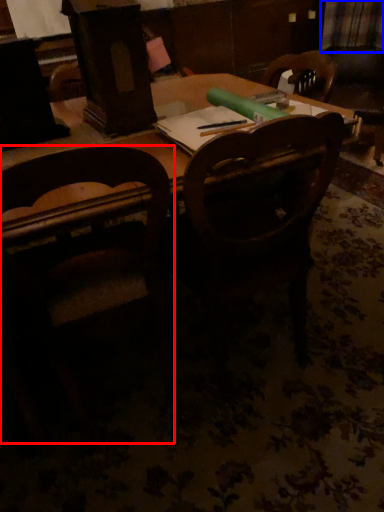
Question: Which object appears farthest to the camera in this image, chair (highlighted by a red box) or plaid (highlighted by a blue box)?

Choices:
 (A) chair
 (B) plaid

Answer: (B)